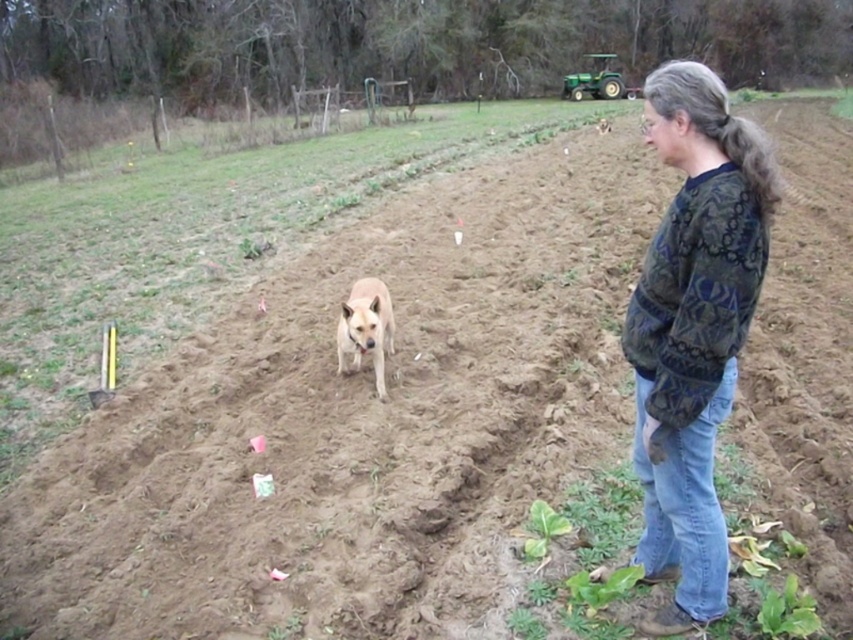
Question: Which of these objects is positioned farthest from the green plastic tractor at upper right?

Choices:
 (A) grayish-brown hair at upper right
 (B) light brown fur at center

Answer: (B)

Question: Is dark green sweater at right to the right of grayish-brown hair at upper right from the viewer's perspective?

Choices:
 (A) yes
 (B) no

Answer: (B)

Question: Considering the real-world distances, which object is farthest from the grayish-brown hair at upper right?

Choices:
 (A) green plastic tractor at upper right
 (B) light brown fur at center

Answer: (A)

Question: Does grayish-brown hair at upper right come behind green plastic tractor at upper right?

Choices:
 (A) no
 (B) yes

Answer: (A)

Question: Does dark green sweater at right appear on the left side of light brown fur at center?

Choices:
 (A) no
 (B) yes

Answer: (A)

Question: Among these objects, which one is nearest to the camera?

Choices:
 (A) dark green sweater at right
 (B) green plastic tractor at upper right
 (C) light brown fur at center

Answer: (A)